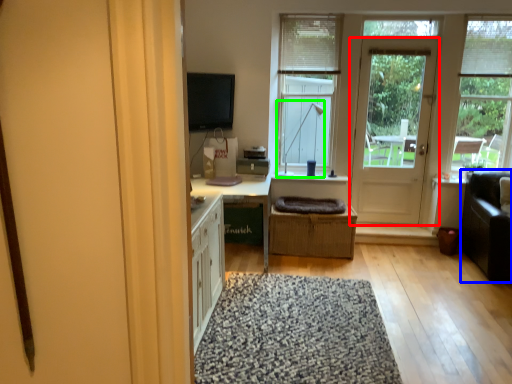
Question: Which object is positioned farthest from door (highlighted by a red box)? Select from couch (highlighted by a blue box) and lamp (highlighted by a green box).

Choices:
 (A) couch
 (B) lamp

Answer: (A)